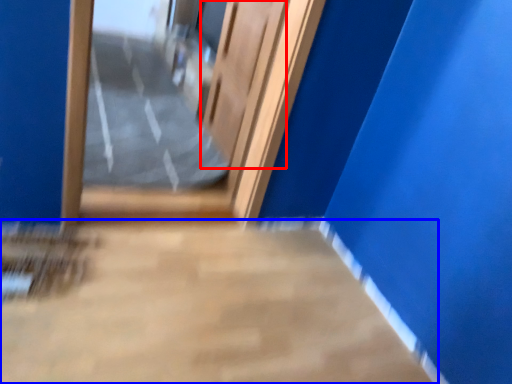
Question: Among these objects, which one is farthest to the camera, elevator door (highlighted by a red box) or concrete (highlighted by a blue box)?

Choices:
 (A) elevator door
 (B) concrete

Answer: (A)